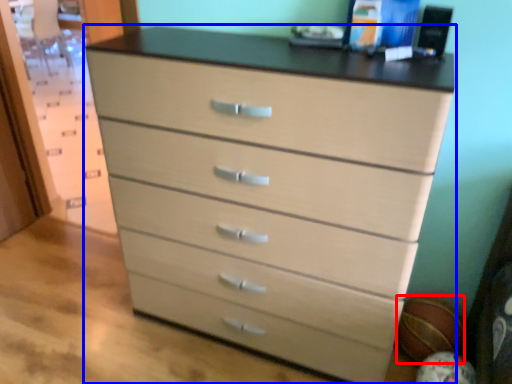
Question: Which point is closer to the camera, basketball (highlighted by a red box) or chest of drawers (highlighted by a blue box)?

Choices:
 (A) basketball
 (B) chest of drawers

Answer: (B)